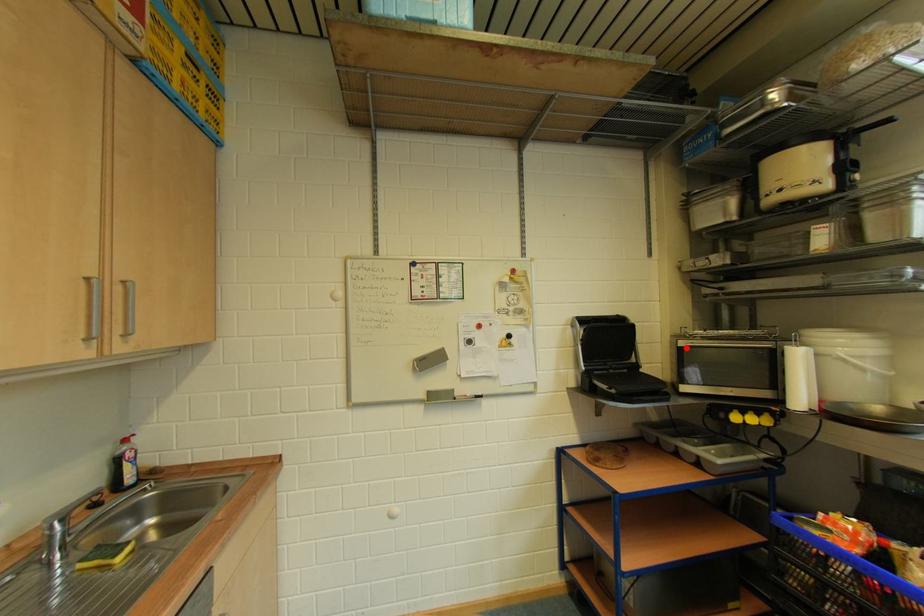
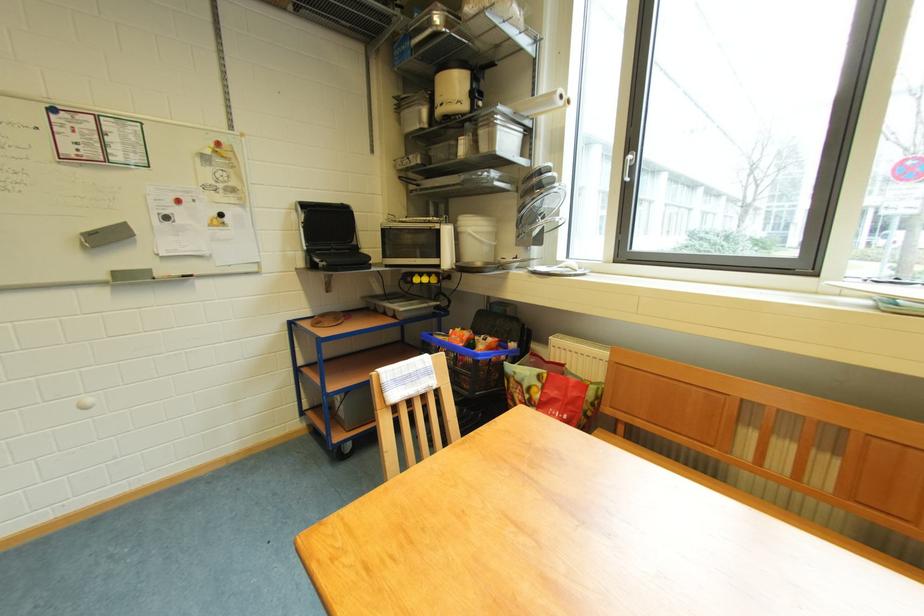
In the second image, find the point that corresponds to the highlighted location in the first image.

(390, 230)